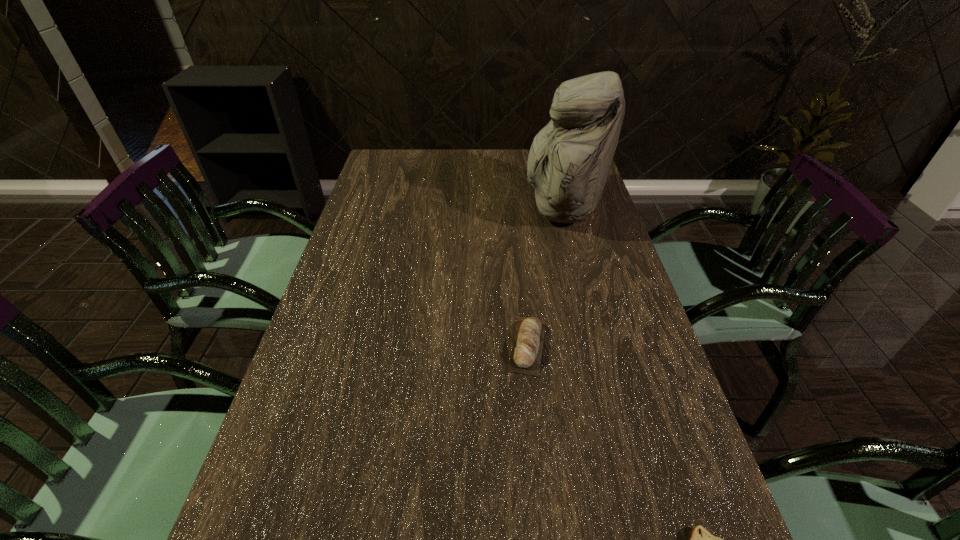
Image resolution: width=960 pixels, height=540 pixels. What are the coordinates of `the tallest object` in the screenshot? It's located at (569, 162).

I want to click on the farthest object, so click(x=569, y=162).

Where is `the farther pita bread`? the farther pita bread is located at coordinates (527, 346).

At what (x,y) coordinates should I click in order to perform the action: click on the second tallest object. Please return your answer as a coordinate pair (x, y). The image size is (960, 540). Looking at the image, I should click on (527, 346).

Find the location of a particular element. This screenshot has height=540, width=960. free location located 0.270m on the front-facing side of the tallest object is located at coordinates (442, 209).

Where is `vacant region located 0.120m on the front-facing side of the tallest object`? This screenshot has height=540, width=960. vacant region located 0.120m on the front-facing side of the tallest object is located at coordinates (487, 209).

Where is `free region located 0.090m on the front-facing side of the tallest object`? This screenshot has height=540, width=960. free region located 0.090m on the front-facing side of the tallest object is located at coordinates 495,209.

Identify the location of free region located on the left of the second shortest object. (413, 346).

Identify the location of object that is at the right edge. This screenshot has height=540, width=960. (569, 162).

The width and height of the screenshot is (960, 540). What are the coordinates of `free space at the far edge of the desktop` in the screenshot? It's located at (473, 163).